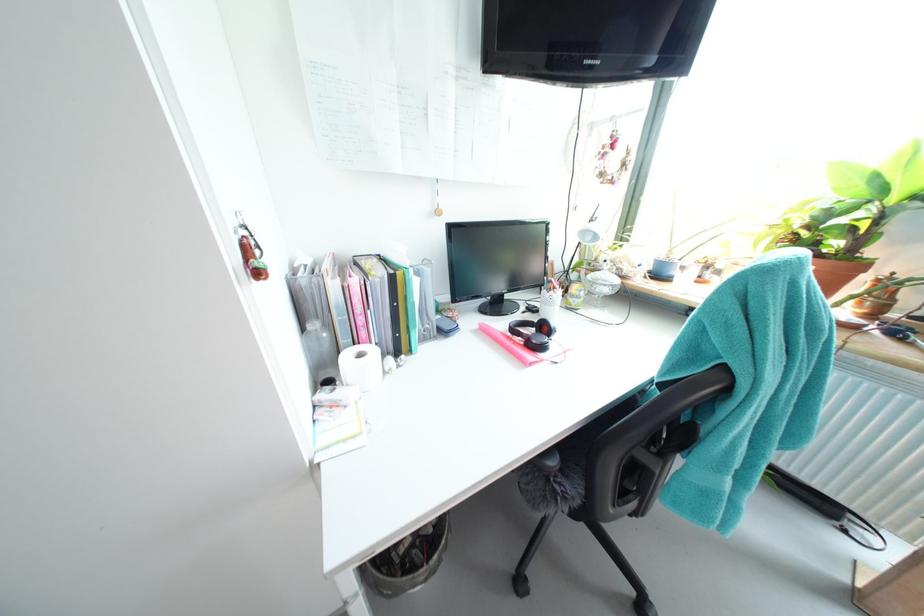
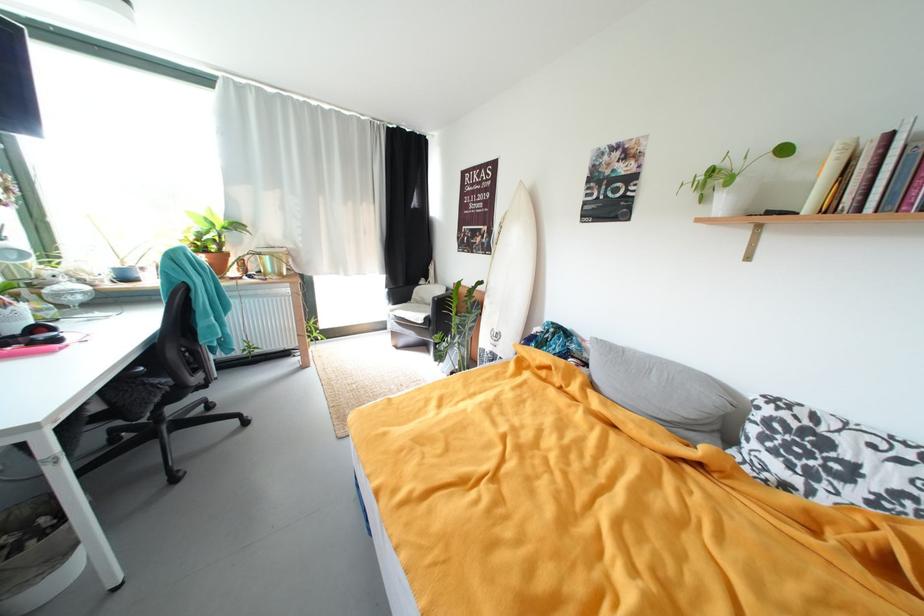
In the second image, find the point that corresponds to pixel 671 259 in the first image.

(127, 268)